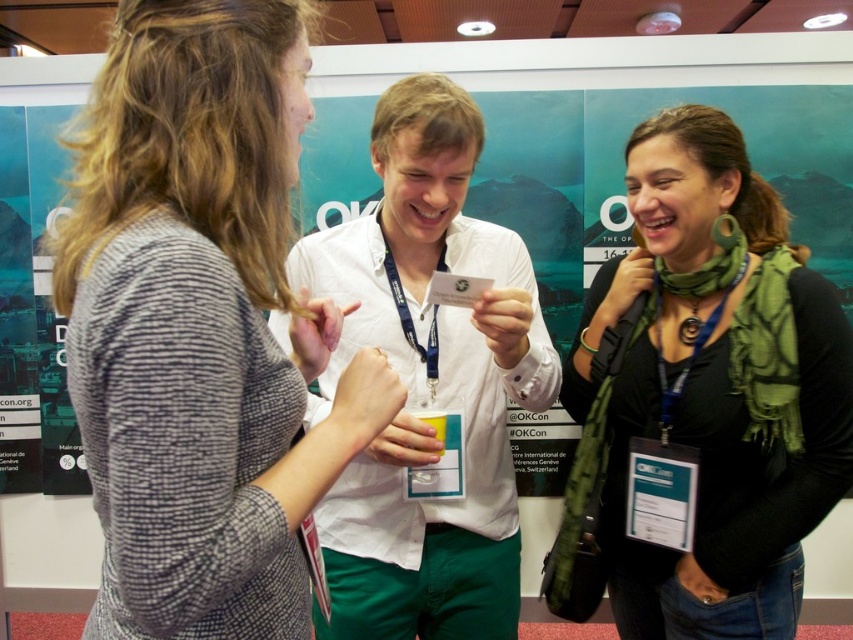
Question: Can you confirm if knitted gray sweater at left is positioned below green fabric scarf at center?

Choices:
 (A) yes
 (B) no

Answer: (B)

Question: Which object is closer to the camera taking this photo?

Choices:
 (A) green fabric scarf at center
 (B) knitted gray sweater at left

Answer: (B)

Question: Is knitted gray sweater at left thinner than green fabric scarf at center?

Choices:
 (A) yes
 (B) no

Answer: (A)

Question: Can you confirm if knitted gray sweater at left is positioned below green fabric scarf at center?

Choices:
 (A) yes
 (B) no

Answer: (B)